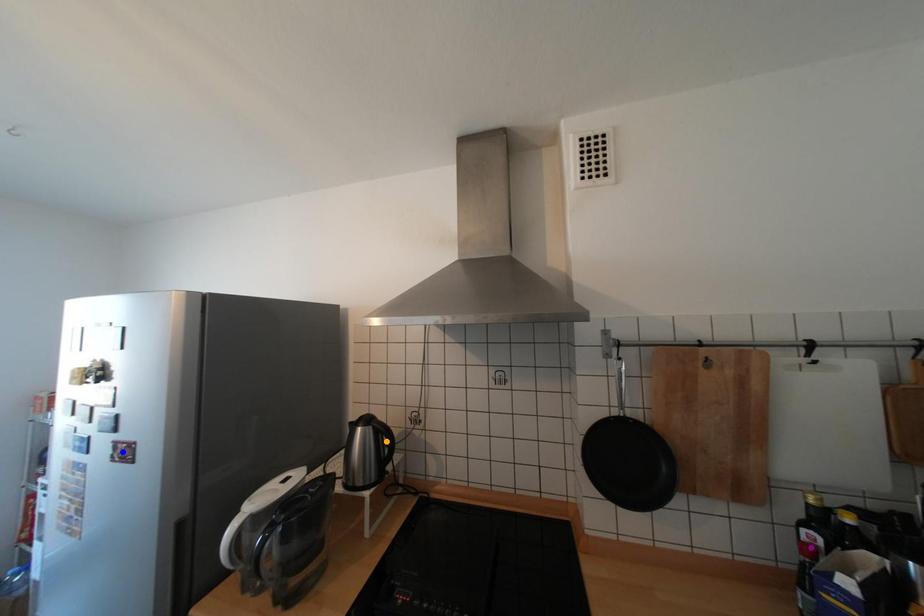
Order these from farthest to nearest:
purple point, blue point, orange point

orange point, blue point, purple point